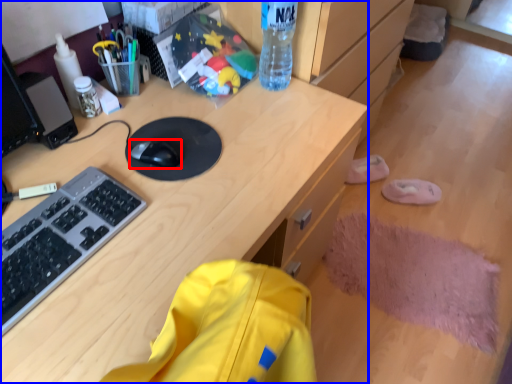
Question: Which object is further to the camera taking this photo, mouse (highlighted by a red box) or desk (highlighted by a blue box)?

Choices:
 (A) mouse
 (B) desk

Answer: (A)